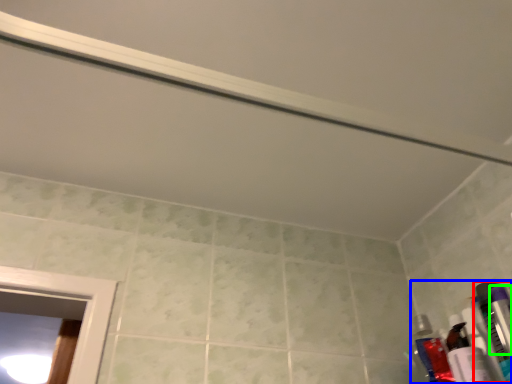
Question: Estimate the real-world distances between objects in this image. Which object is farther from toiletry (highlighted by a red box), toiletry (highlighted by a blue box) or toiletry (highlighted by a green box)?

Choices:
 (A) toiletry
 (B) toiletry

Answer: (B)